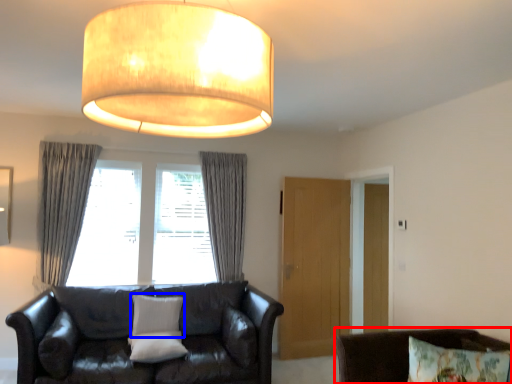
Question: Which object appears farthest to the camera in this image, chair (highlighted by a red box) or pillow (highlighted by a blue box)?

Choices:
 (A) chair
 (B) pillow

Answer: (B)